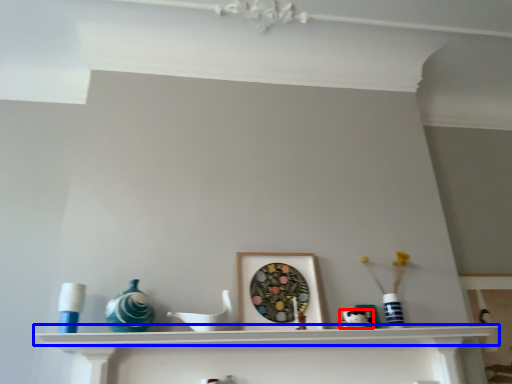
Question: Which object appears farthest to the camera in this image, art (highlighted by a red box) or shelf (highlighted by a blue box)?

Choices:
 (A) art
 (B) shelf

Answer: (A)